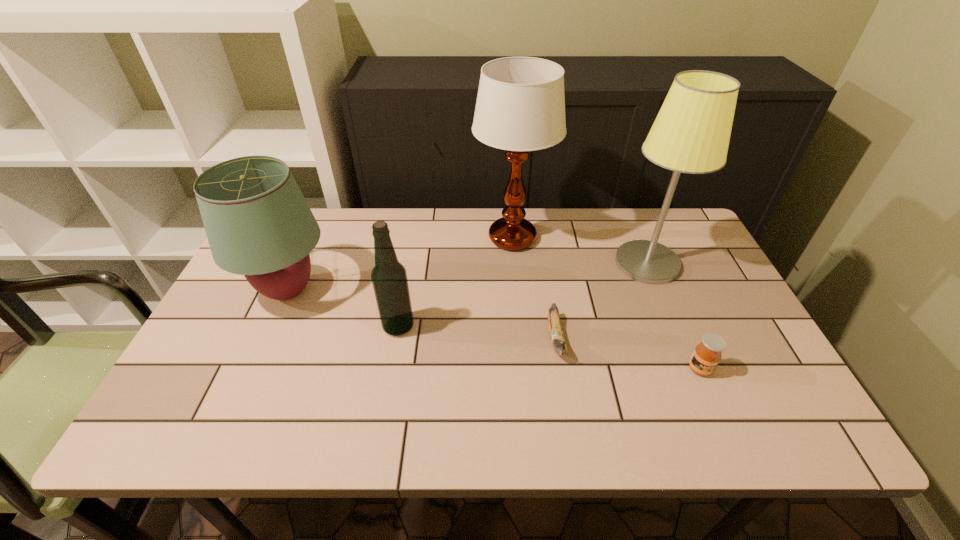
In order to click on vacant space located on the front-facing side of the honey in this screenshot , I will do `click(724, 424)`.

Find the location of a particular element. Image resolution: width=960 pixels, height=540 pixels. free space located at the stem of the banana is located at coordinates (572, 441).

Where is `object located in the left edge section of the desktop`? The image size is (960, 540). object located in the left edge section of the desktop is located at coordinates (258, 224).

Image resolution: width=960 pixels, height=540 pixels. What are the coordinates of `table lamp present at the right edge` in the screenshot? It's located at (691, 133).

Image resolution: width=960 pixels, height=540 pixels. Find the location of `honey positioned at the right edge`. honey positioned at the right edge is located at coordinates (707, 354).

Identify the location of object that is at the far right corner. The height and width of the screenshot is (540, 960). (691, 133).

Find the location of a particular element. The width and height of the screenshot is (960, 540). blank space at the far edge is located at coordinates click(415, 222).

Locate an element on the screen. vacant space at the near edge is located at coordinates (384, 407).

This screenshot has height=540, width=960. I want to click on vacant area at the left edge, so click(x=214, y=388).

Where is `blank space at the right edge of the desktop`? Image resolution: width=960 pixels, height=540 pixels. blank space at the right edge of the desktop is located at coordinates (726, 286).